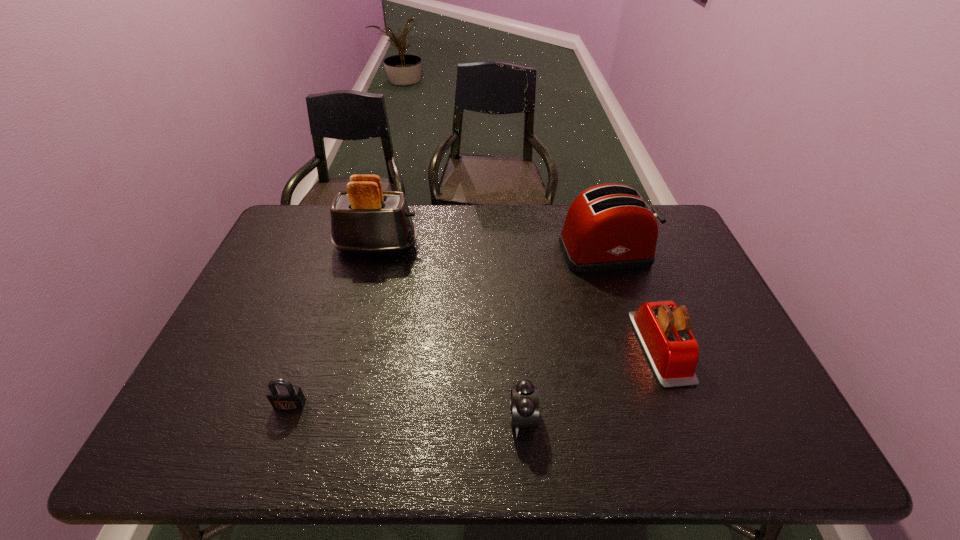
Identify the location of unoccupied area between the third object from right to left and the leftmost toaster. This screenshot has height=540, width=960. (450, 332).

What are the coordinates of `vacant region between the second tallest object and the alarm clock` in the screenshot? It's located at (x=564, y=335).

The width and height of the screenshot is (960, 540). Find the location of `empty space between the padlock and the third object from left to right`. empty space between the padlock and the third object from left to right is located at coordinates (406, 411).

At what (x,y) coordinates should I click in order to perform the action: click on free space between the padlock and the third object from left to right. Please return your answer as a coordinate pair (x, y). Looking at the image, I should click on coord(406,411).

The width and height of the screenshot is (960, 540). Identify the location of free space that is in between the third object from right to left and the leftmost toaster. point(450,332).

Where is `blank region between the padlock and the second shortest toaster`? This screenshot has width=960, height=540. blank region between the padlock and the second shortest toaster is located at coordinates [x=448, y=328].

I want to click on free spot between the second shortest toaster and the alarm clock, so click(x=564, y=335).

In order to click on free spot between the third tallest object and the alarm clock in this screenshot , I will do `click(591, 383)`.

The image size is (960, 540). What are the coordinates of `unoccupied area between the third nearest object and the padlock` in the screenshot? It's located at (475, 376).

Find the location of `unoccupied area between the leftmost toaster and the second tallest object`. unoccupied area between the leftmost toaster and the second tallest object is located at coordinates (492, 249).